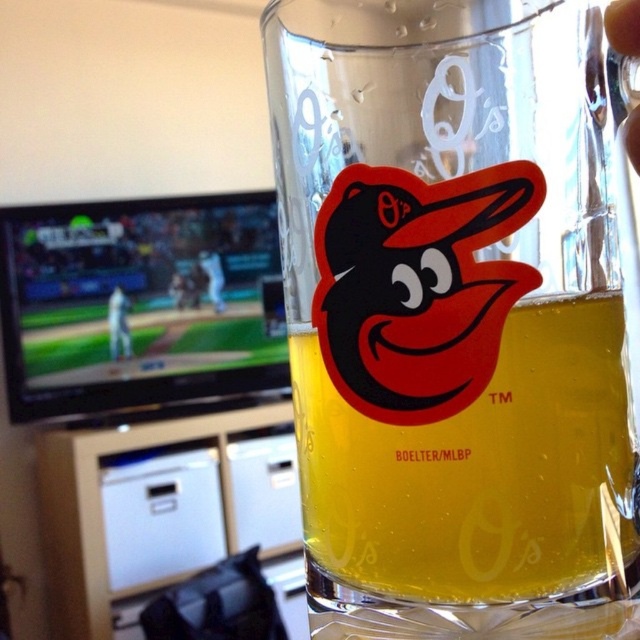
Question: Can you confirm if clear glass beer mug at center is thinner than translucent glass beer at center?

Choices:
 (A) yes
 (B) no

Answer: (B)

Question: Which point is closer to the camera?

Choices:
 (A) (561, 96)
 (B) (620, 308)

Answer: (A)

Question: Which object is closer to the camera taking this photo?

Choices:
 (A) translucent glass beer at center
 (B) clear glass beer mug at center
 (C) white uniform at left

Answer: (B)

Question: Which point is closer to the camera taking this photo?

Choices:
 (A) (116, 316)
 (B) (376, 467)

Answer: (B)

Question: Considering the relative positions of clear glass beer mug at center and translucent glass beer at center in the image provided, where is clear glass beer mug at center located with respect to translucent glass beer at center?

Choices:
 (A) above
 (B) below

Answer: (A)

Question: Does clear glass beer mug at center have a lesser width compared to translucent glass beer at center?

Choices:
 (A) no
 (B) yes

Answer: (A)